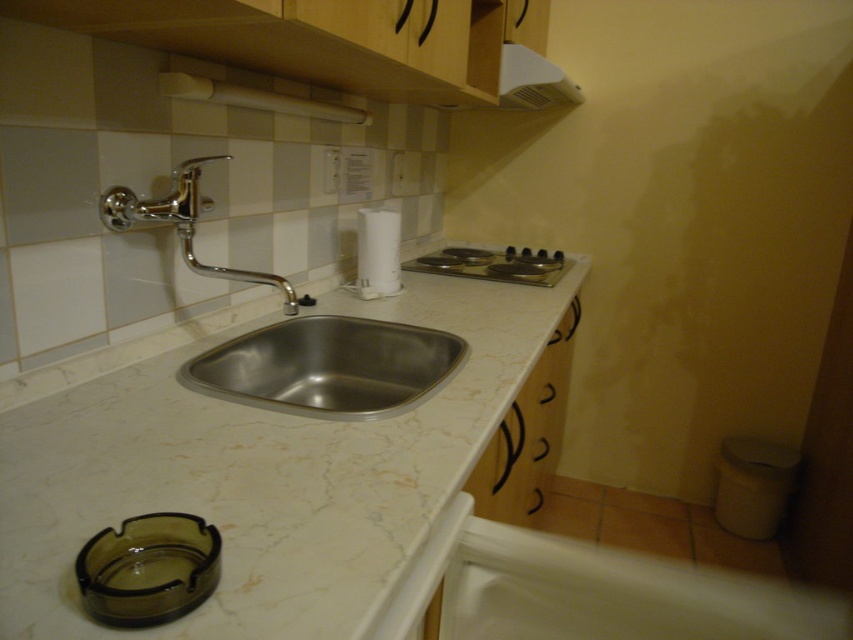
Can you confirm if stainless steel sink at center is positioned to the left of chrome/metallic faucet at upper left?

No, stainless steel sink at center is not to the left of chrome/metallic faucet at upper left.

This screenshot has height=640, width=853. What do you see at coordinates (328, 365) in the screenshot?
I see `stainless steel sink at center` at bounding box center [328, 365].

What are the coordinates of `stainless steel sink at center` in the screenshot? It's located at (328, 365).

Is marble/stone counter top at center shorter than chrome/metallic faucet at upper left?

Incorrect, marble/stone counter top at center's height does not fall short of chrome/metallic faucet at upper left's.

Which is below, marble/stone counter top at center or chrome/metallic faucet at upper left?

marble/stone counter top at center is lower down.

Between point (45, 570) and point (128, 227), which one is positioned in front?

Positioned in front is point (45, 570).

Find the location of a particular element. Image resolution: width=853 pixels, height=640 pixels. marble/stone counter top at center is located at coordinates (267, 477).

Can you confirm if marble/stone counter top at center is positioned above stainless steel sink at center?

Indeed, marble/stone counter top at center is positioned over stainless steel sink at center.

Between marble/stone counter top at center and stainless steel sink at center, which one is positioned higher?

marble/stone counter top at center is above.

Image resolution: width=853 pixels, height=640 pixels. Identify the location of marble/stone counter top at center. (267, 477).